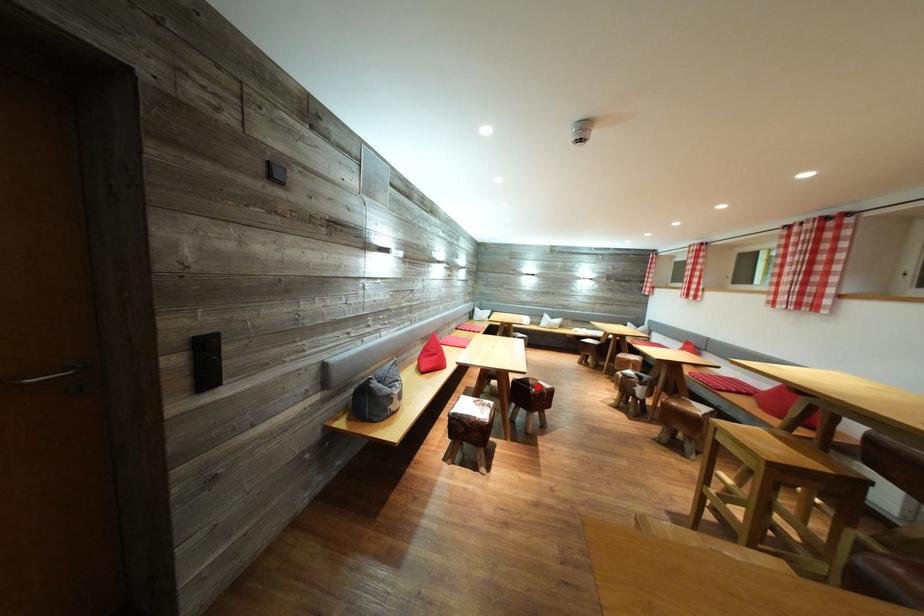
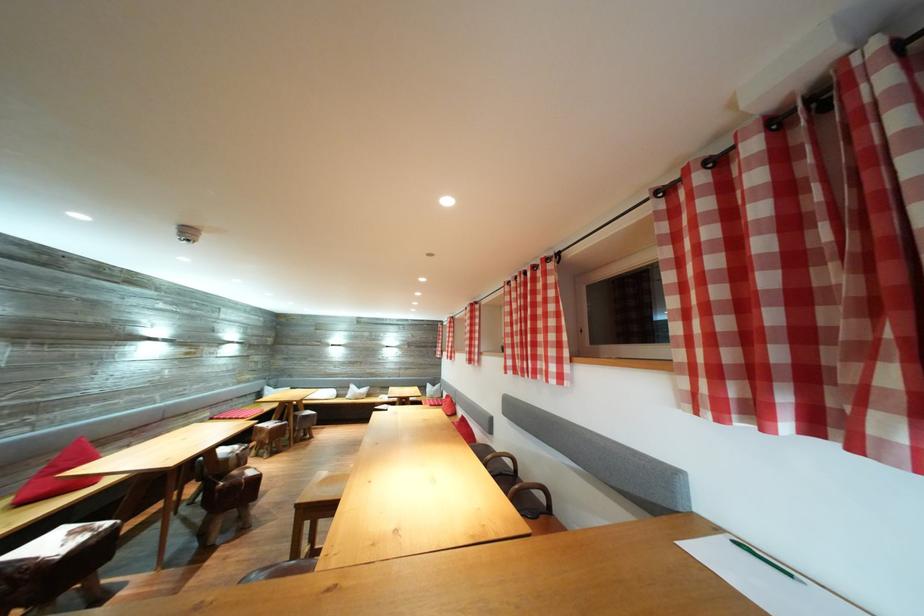
Question: I am providing you with two images of the same scene from different viewpoints. Image1 has a red point marked. In image2, the corresponding 3D location appears at what relative position? Reply with the corresponding letter.

Choices:
 (A) Closer
 (B) Farther

Answer: (A)